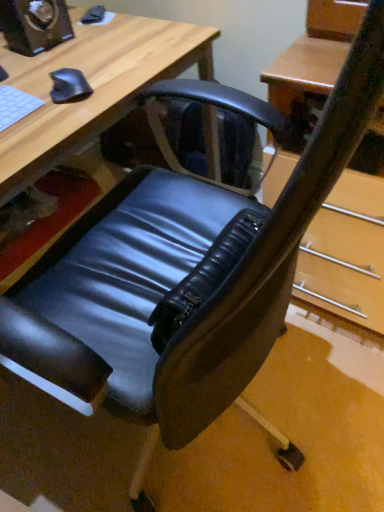
The image size is (384, 512). What are the coordinates of `unoccupied region to the right of matte black speaker at upper left` in the screenshot? It's located at (105, 36).